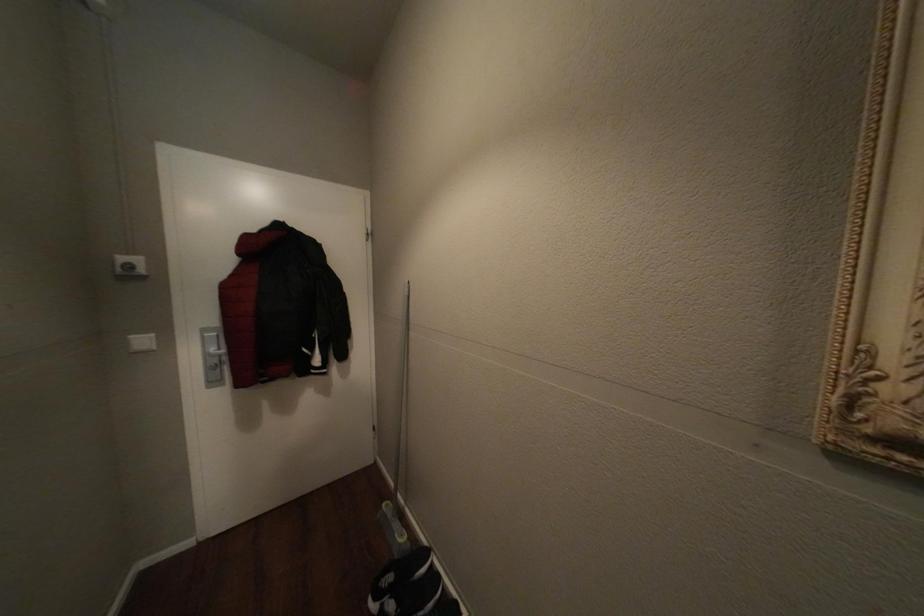
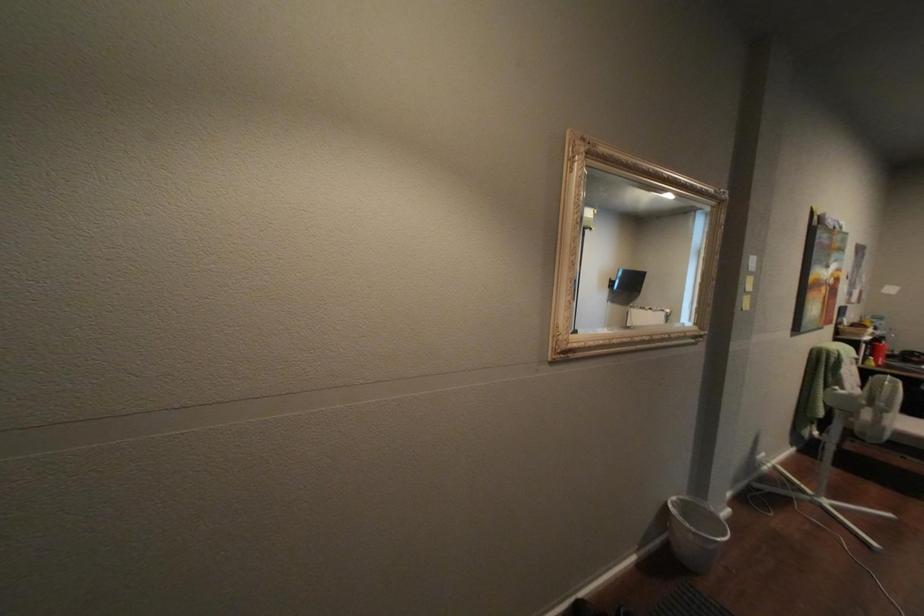
Question: How did the camera likely rotate?

Choices:
 (A) Left
 (B) Right
 (C) Up
 (D) Down

Answer: (B)